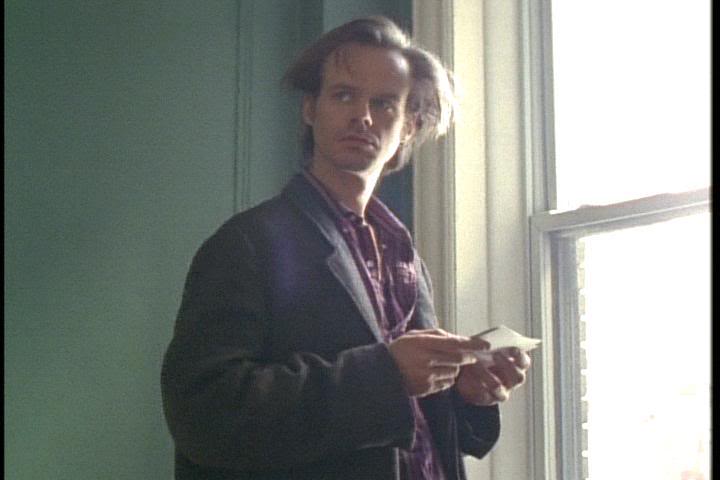
Identify the location of wall area. The height and width of the screenshot is (480, 720). (166, 129).